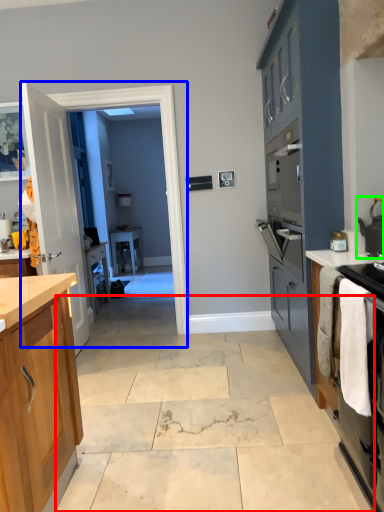
Question: Which object is the closest to the concrete (highlighted by a red box)? Choose among these: glass door (highlighted by a blue box) or kitchen appliance (highlighted by a green box).

Choices:
 (A) glass door
 (B) kitchen appliance

Answer: (A)